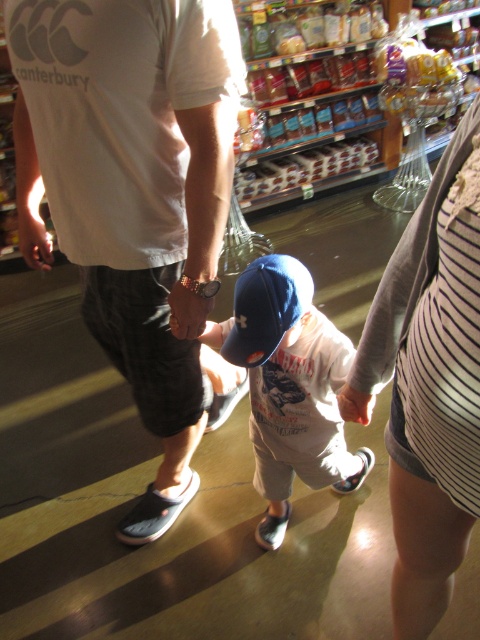
Question: Is the position of striped fabric shirt at center more distant than that of matte blue cap at center?

Choices:
 (A) yes
 (B) no

Answer: (B)

Question: Is striped fabric shirt at center closer to the viewer compared to matte blue cap at center?

Choices:
 (A) yes
 (B) no

Answer: (A)

Question: Which point is farther to the camera?

Choices:
 (A) matte blue cap at center
 (B) striped fabric shirt at center
 (C) blue fabric cap at center
 (D) white cotton t-shirt at center

Answer: (A)

Question: Which point is farther from the camera taking this photo?

Choices:
 (A) (342, 342)
 (B) (20, 20)
 (C) (262, 285)
 (D) (420, 232)

Answer: (A)

Question: Which is nearer to the white cotton t-shirt at center?

Choices:
 (A) matte blue cap at center
 (B) striped fabric shirt at center
 (C) blue fabric cap at center

Answer: (C)

Question: Is striped fabric shirt at center to the left of blue fabric cap at center from the viewer's perspective?

Choices:
 (A) yes
 (B) no

Answer: (B)